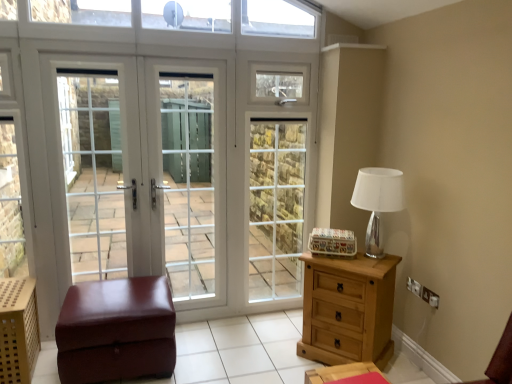
Question: From a real-world perspective, is white glass screen door at left, the third screen door from the right, positioned over white glass door at center based on gravity?

Choices:
 (A) no
 (B) yes

Answer: (B)

Question: Is white glass screen door at left, the third screen door from the right, located outside white glass door at center?

Choices:
 (A) no
 (B) yes

Answer: (A)

Question: Can you confirm if white glass screen door at left, the third screen door from the right, is thinner than white glass door at center?

Choices:
 (A) yes
 (B) no

Answer: (A)

Question: Could you tell me if white glass screen door at left, the third screen door from the right, is turned towards white glass door at center?

Choices:
 (A) yes
 (B) no

Answer: (A)

Question: Is white glass screen door at left, arranged as the first screen door when viewed from the left, taller than white glass door at center?

Choices:
 (A) yes
 (B) no

Answer: (B)

Question: Considering the relative sizes of white glass screen door at left, the third screen door from the right, and white glass door at center in the image provided, is white glass screen door at left, the third screen door from the right, smaller than white glass door at center?

Choices:
 (A) no
 (B) yes

Answer: (B)

Question: From a real-world perspective, is light brown wooden chest of drawers at right physically below white glass screen door at left, the third screen door from the right?

Choices:
 (A) yes
 (B) no

Answer: (A)

Question: From the image's perspective, is light brown wooden chest of drawers at right on top of white glass screen door at left, arranged as the first screen door when viewed from the left?

Choices:
 (A) no
 (B) yes

Answer: (A)

Question: Does light brown wooden chest of drawers at right have a smaller size compared to white glass screen door at left, the third screen door from the right?

Choices:
 (A) yes
 (B) no

Answer: (B)

Question: Is light brown wooden chest of drawers at right behind white glass screen door at left, the third screen door from the right?

Choices:
 (A) no
 (B) yes

Answer: (A)

Question: Would you say white glass screen door at left, arranged as the first screen door when viewed from the left, is part of light brown wooden chest of drawers at right's contents?

Choices:
 (A) no
 (B) yes

Answer: (A)

Question: Considering the relative sizes of light brown wooden chest of drawers at right and white glass screen door at left, arranged as the first screen door when viewed from the left, in the image provided, is light brown wooden chest of drawers at right taller than white glass screen door at left, arranged as the first screen door when viewed from the left,?

Choices:
 (A) yes
 (B) no

Answer: (B)

Question: Considering the relative positions of white glass screen door at left, the third screen door from the right, and brown leather ottoman at lower left in the image provided, is white glass screen door at left, the third screen door from the right, in front of brown leather ottoman at lower left?

Choices:
 (A) yes
 (B) no

Answer: (B)